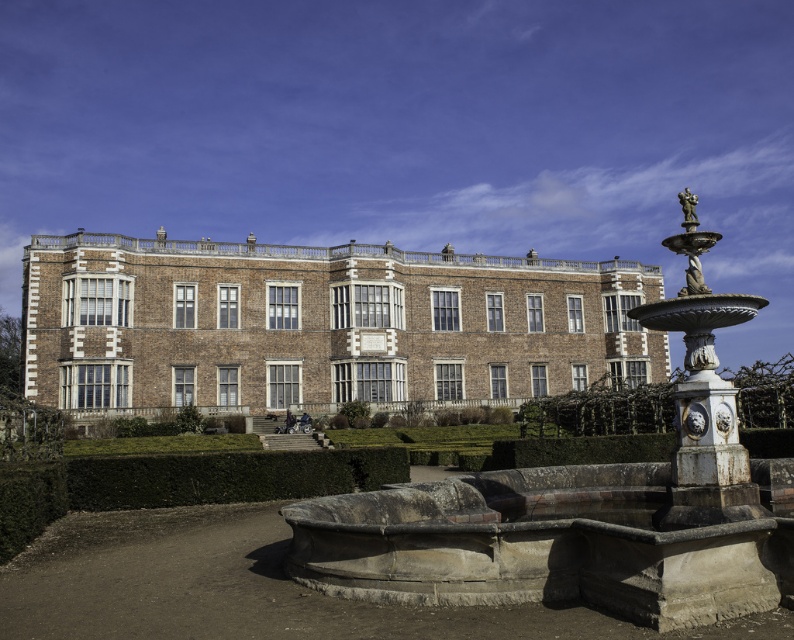
Does white stone fountain at center come behind white marble fountain at right?

No, white stone fountain at center is closer to the viewer.

Who is positioned more to the left, white stone fountain at center or white marble fountain at right?

Positioned to the left is white stone fountain at center.

What are the coordinates of `white stone fountain at center` in the screenshot? It's located at (577, 516).

I want to click on white stone fountain at center, so click(x=577, y=516).

Which of these two, white stone fountain at center or green leafy hedge at center, stands taller?

white stone fountain at center

This screenshot has width=794, height=640. Find the location of `white stone fountain at center`. white stone fountain at center is located at coordinates (577, 516).

Between point (596, 490) and point (581, 404), which one is positioned behind?

Positioned behind is point (581, 404).

You are a GUI agent. You are given a task and a screenshot of the screen. Output one action in this format:
    pyautogui.click(x=<x>, y=<y>)
    Task: Click on the white stone fountain at center
    
    Given the screenshot: What is the action you would take?
    pyautogui.click(x=577, y=516)

Between white marble fountain at right and bronze statue at upper right, which one appears on the left side from the viewer's perspective?

From the viewer's perspective, white marble fountain at right appears more on the left side.

Between point (673, 237) and point (681, 195), which one is positioned behind?

The point (681, 195) is more distant.

Locate an element on the screen. white marble fountain at right is located at coordinates (692, 244).